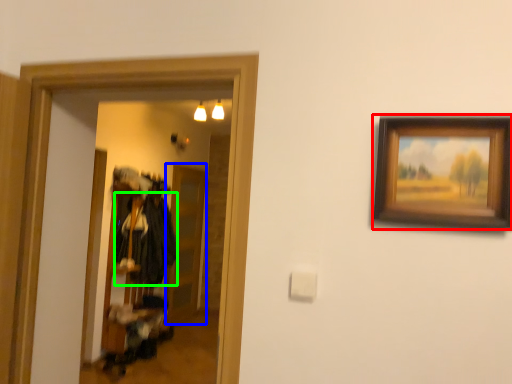
Question: Based on their relative distances, which object is nearer to picture frame (highlighted by a red box)? Choose from glass door (highlighted by a blue box) and clothing (highlighted by a green box).

Choices:
 (A) glass door
 (B) clothing

Answer: (B)